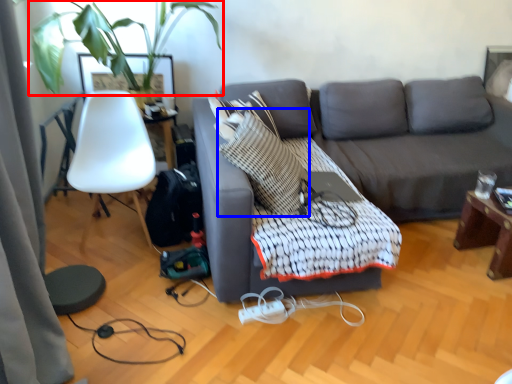
Question: Among these objects, which one is farthest to the camera, plant (highlighted by a red box) or throw pillow (highlighted by a blue box)?

Choices:
 (A) plant
 (B) throw pillow

Answer: (B)